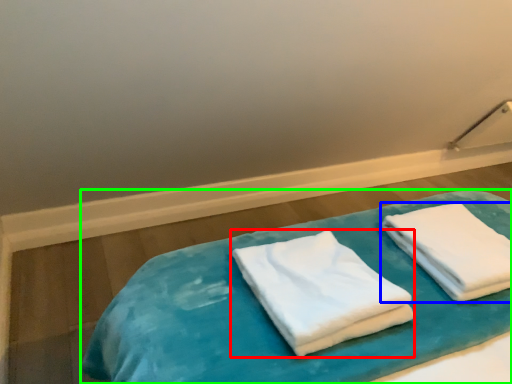
Question: Which is farther away from towel (highlighted by a red box)? towel (highlighted by a blue box) or bed (highlighted by a green box)?

Choices:
 (A) towel
 (B) bed

Answer: (A)